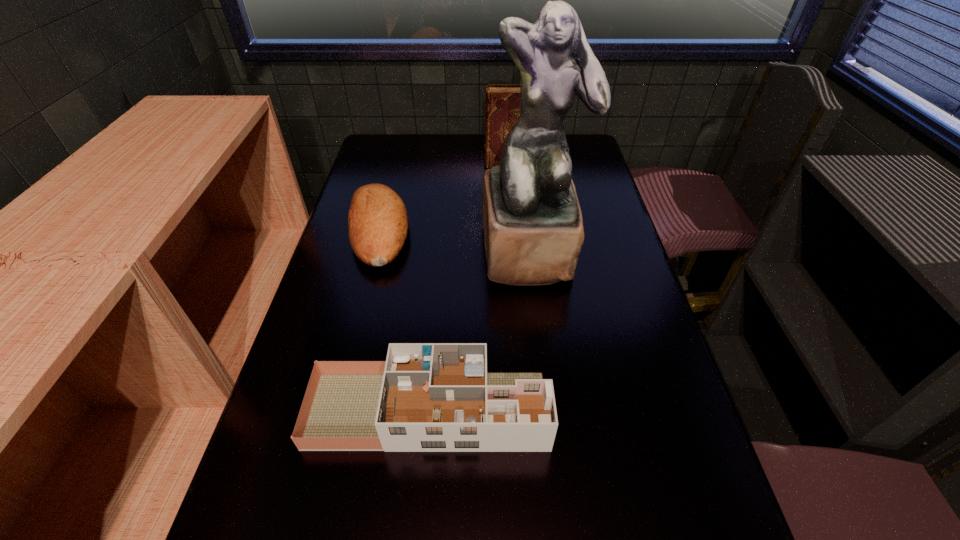
Locate an element on the screen. The image size is (960, 540). vacant space that's between the bread and the sculpture is located at coordinates (454, 240).

Find the location of a particular element. This screenshot has height=540, width=960. free point between the nearest object and the hardback book is located at coordinates (471, 287).

This screenshot has height=540, width=960. What are the coordinates of `vacant space in between the dollhouse and the bread` in the screenshot? It's located at (403, 321).

The height and width of the screenshot is (540, 960). What are the coordinates of `vacant area that lies between the bread and the sculpture` in the screenshot? It's located at (454, 240).

Locate an element on the screen. unoccupied position between the nearest object and the second tallest object is located at coordinates (471, 287).

The image size is (960, 540). I want to click on free space between the nearest object and the farthest object, so 471,287.

Identify which object is the nearest to the bread. Please provide its 2D coordinates. Your answer should be formatted as a tuple, i.e. [(x, y)], where the tuple contains the x and y coordinates of a point satisfying the conditions above.

[(533, 228)]

Locate an element on the screen. The image size is (960, 540). object that is the closest to the bread is located at coordinates (533, 228).

Find the location of a particular element. free space that satisfies the following two spatial constraints: 1. in a relaxed pose on the sculpture; 2. at the front door of the nearest object is located at coordinates (549, 410).

This screenshot has width=960, height=540. What are the coordinates of `vacant space that satisfies the following two spatial constraints: 1. in a relaxed pose on the tallest object; 2. at the front door of the nearest object` in the screenshot? It's located at (549, 410).